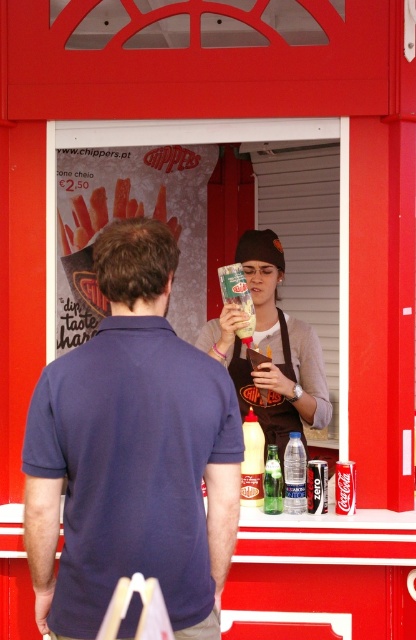
You are a customer at the Chippers stall and want to ask the staff about the condiments. Which item is bigger between the brown fabric apron at center and the yellow plastic bottle at center?

The brown fabric apron at center is larger in size than the yellow plastic bottle at center, so the brown fabric apron at center is bigger.

You are a customer at the Chippers stall and you want to grab the green glass bottle at center. However, there is a navy blue polo shirt at center in the way. Can you reach the bottle without moving the shirt?

The navy blue polo shirt at center is larger in size than green glass bottle at center, so it might block access to the bottle. You should ask the staff to move the shirt first.